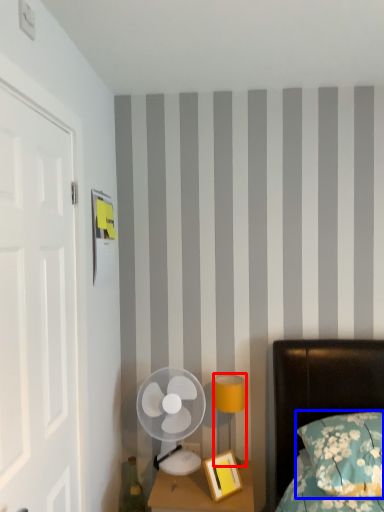
Question: Which of the following is the farthest to the observer, bedside lamp (highlighted by a red box) or pillow (highlighted by a blue box)?

Choices:
 (A) bedside lamp
 (B) pillow

Answer: (A)